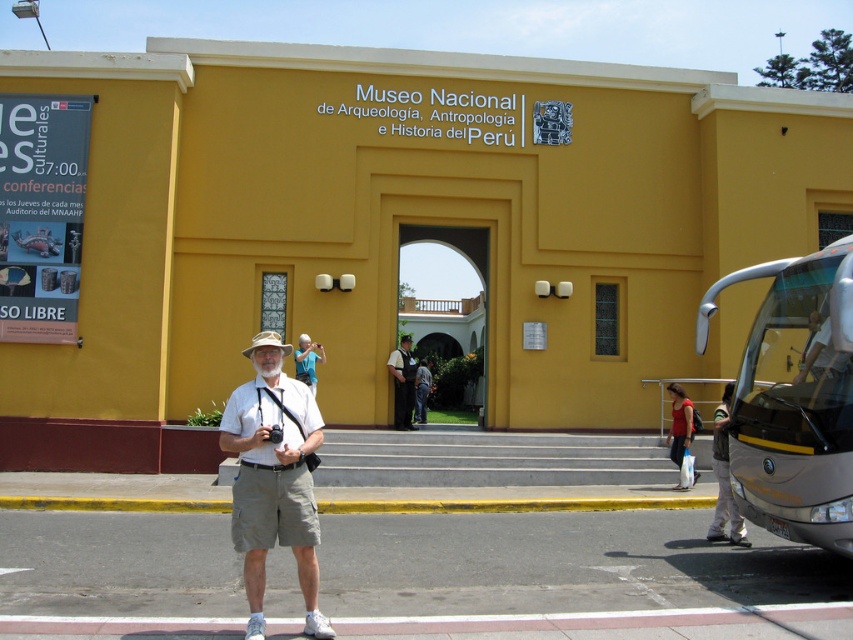
You are a tourist standing in front of the museum. You see a silver metallic bus at right and denim pants at lower right. Which object is closer to the entrance of the museum?

The denim pants at lower right are closer to the entrance of the museum because the silver metallic bus at right is to the left of denim pants at lower right, meaning the bus is further away from the entrance compared to the pants.

You are a fashion designer observing a man dressed in khaki cotton shorts at center and blue fabric shirt at center. Which clothing item is wider?

The khaki cotton shorts at center are wider than the blue fabric shirt at center.